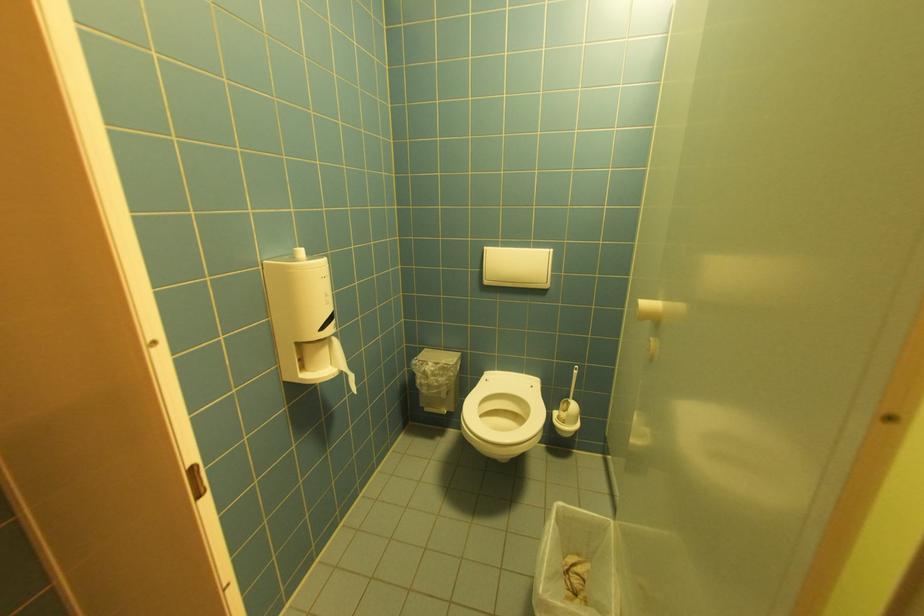
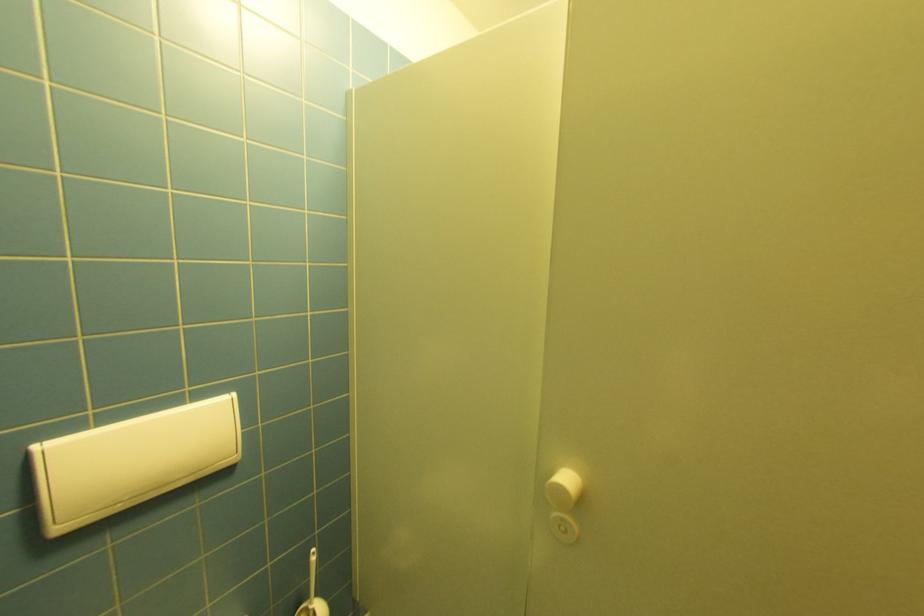
In the second image, find the point that corresponds to point (492, 283) in the first image.

(66, 530)